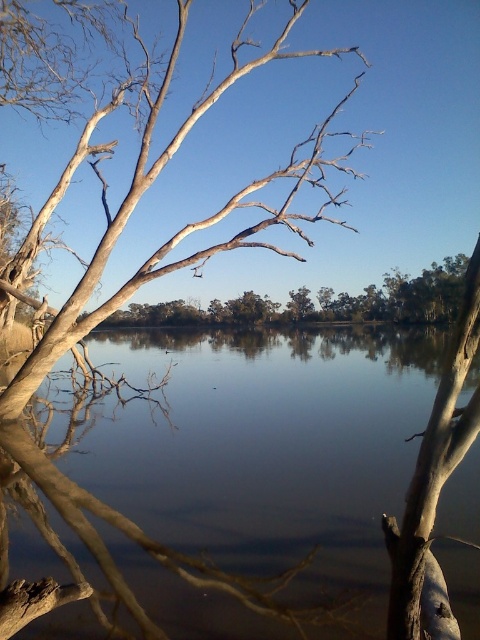
Identify the location of smooth water at center. (264, 449).

Between smooth water at center and white textured bark at upper right, which one appears on the right side from the viewer's perspective?

Positioned to the right is smooth water at center.

Locate an element on the screen. This screenshot has height=640, width=480. smooth water at center is located at coordinates (264, 449).